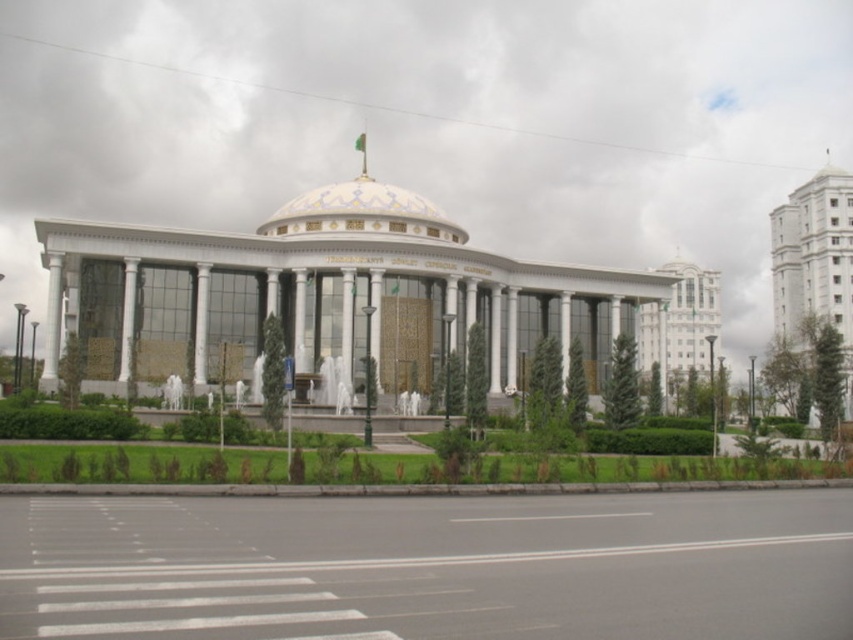
Question: Can you confirm if white glossy dome at center is bigger than white glossy building at upper right?

Choices:
 (A) no
 (B) yes

Answer: (B)

Question: Which point is closer to the camera?

Choices:
 (A) (805, 266)
 (B) (322, 218)
 (C) (556, 339)
 (D) (672, 288)

Answer: (B)

Question: Is white marble building at right thinner than white glossy dome at center?

Choices:
 (A) yes
 (B) no

Answer: (B)

Question: Among these objects, which one is farthest from the camera?

Choices:
 (A) white glossy building at upper right
 (B) white marble palace at center
 (C) white marble building at right
 (D) white glossy dome at center

Answer: (D)

Question: Can you confirm if white marble palace at center is positioned to the right of white marble building at right?

Choices:
 (A) yes
 (B) no

Answer: (B)

Question: Considering the real-world distances, which object is closest to the white marble palace at center?

Choices:
 (A) white glossy dome at center
 (B) white marble building at right
 (C) white glossy building at upper right

Answer: (A)